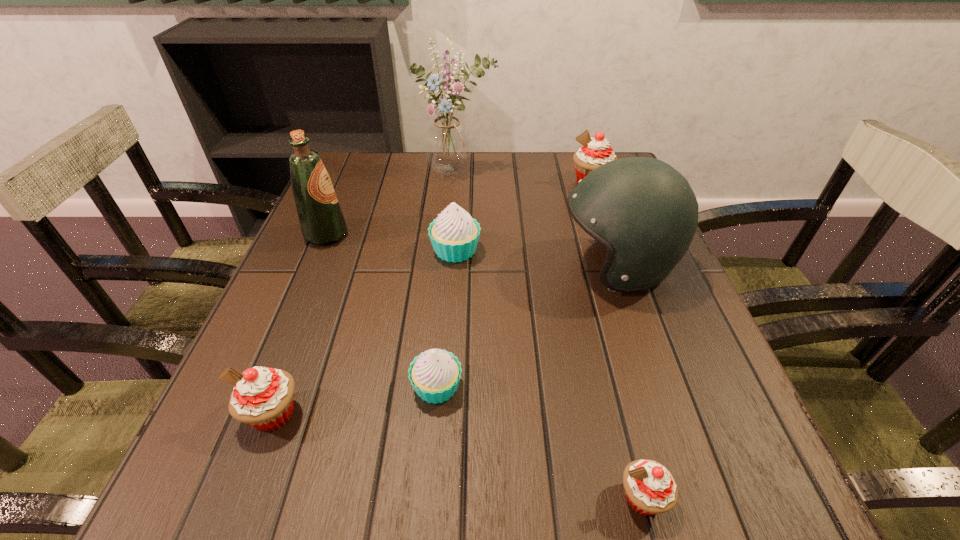
The height and width of the screenshot is (540, 960). I want to click on vacant point located between the biggest pink cupcake and the leftmost pink cupcake, so click(x=432, y=298).

Find the location of `free space that is in between the farther white cupcake and the leftmost pink cupcake`. free space that is in between the farther white cupcake and the leftmost pink cupcake is located at coordinates (364, 332).

Locate an element on the screen. This screenshot has height=540, width=960. free space that is in between the tallest object and the smallest pink cupcake is located at coordinates (549, 335).

The height and width of the screenshot is (540, 960). Identify the location of free space between the nearest cupcake and the second nearest pink cupcake. (458, 456).

This screenshot has width=960, height=540. Find the location of `unoccupied position between the second farthest pink cupcake and the nearest pink cupcake`. unoccupied position between the second farthest pink cupcake and the nearest pink cupcake is located at coordinates (458, 456).

At what (x,y) coordinates should I click in order to perform the action: click on the closest object to the biggest pink cupcake. Please return your answer as a coordinate pair (x, y). This screenshot has height=540, width=960. Looking at the image, I should click on (645, 213).

Where is `object that stands as the closest to the farthest pink cupcake`? object that stands as the closest to the farthest pink cupcake is located at coordinates (645, 213).

This screenshot has width=960, height=540. Identify the location of cupcake object that ranks as the third closest to the leftmost pink cupcake. (650, 488).

Where is `cupcake that can be found as the fourth closest to the smaller white cupcake`? Image resolution: width=960 pixels, height=540 pixels. cupcake that can be found as the fourth closest to the smaller white cupcake is located at coordinates (595, 151).

At what (x,y) coordinates should I click in order to perform the action: click on pink cupcake that is the nearest to the green olive oil. Please return your answer as a coordinate pair (x, y). Looking at the image, I should click on (263, 398).